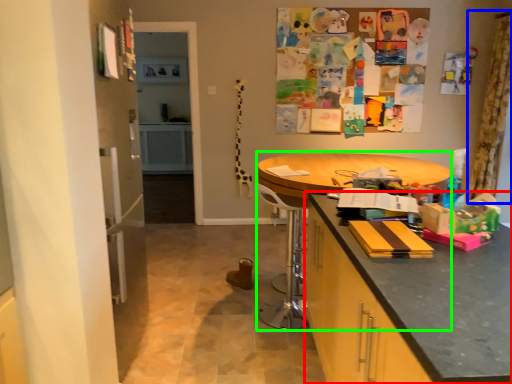
Question: Which is nearer to the cabinetry (highlighted by a red box)? curtain (highlighted by a blue box) or round table (highlighted by a green box).

Choices:
 (A) curtain
 (B) round table

Answer: (B)